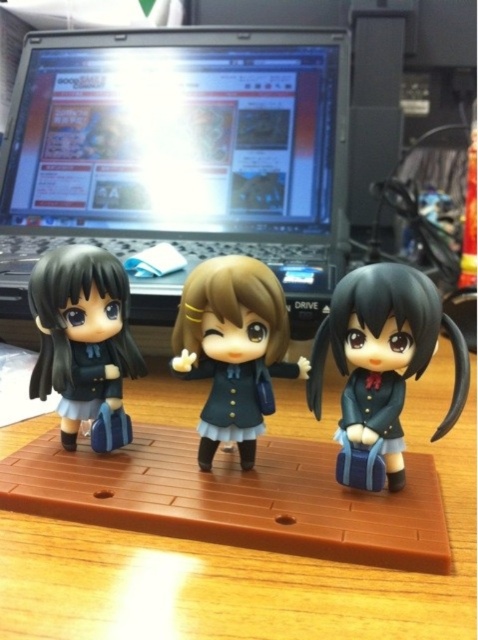
You are organizing a display on a desk and need to place a new figurine between the matte green uniform at center and the matte black doll at left. The new figurine is 3 inches wide. Will there be enough space between the two existing figurines to fit it?

The distance between the matte green uniform at center and the matte black doll at left is 6.53 inches. Since the new figurine is 3 inches wide, there is sufficient space to place it between them.

You are organizing a display on a desk and need to place a new item between the black glossy laptop at upper center and the matte black doll at right. Based on their current positions, which object should the new item be placed to the right of?

The new item should be placed to the right of the black glossy laptop at upper center because it is positioned to the left of the matte black doll at right.